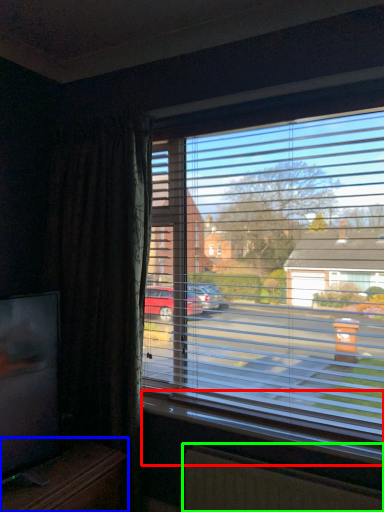
Question: Which object is positioned farthest from window sill (highlighted by a red box)? Select from entertainment center (highlighted by a blue box) and radiator (highlighted by a green box).

Choices:
 (A) entertainment center
 (B) radiator

Answer: (A)